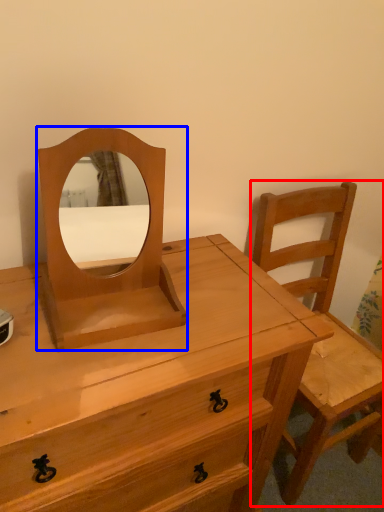
Question: Which of the following is the closest to the observer, chair (highlighted by a red box) or mirror (highlighted by a blue box)?

Choices:
 (A) chair
 (B) mirror

Answer: (B)